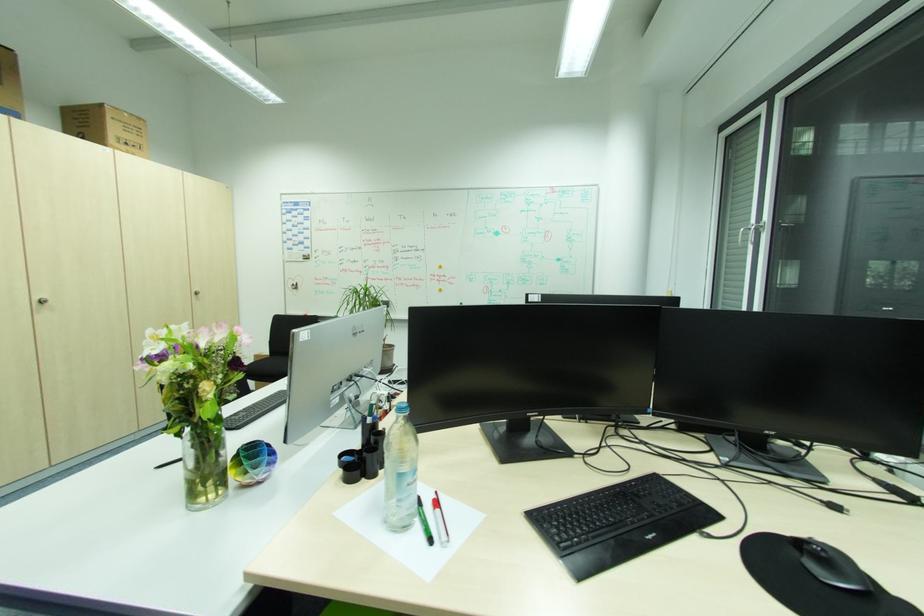
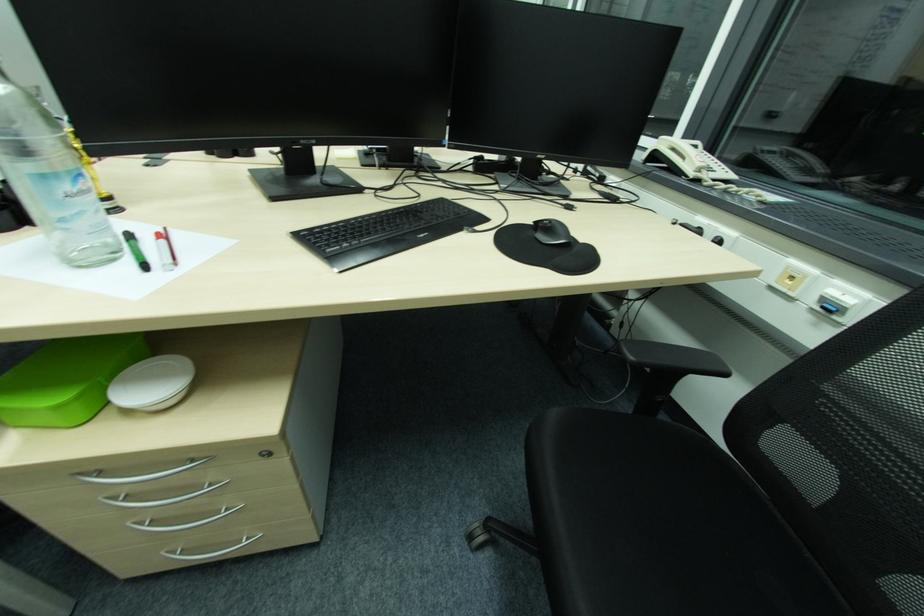
Find the pixel in the second image that matches pixel 436 541 in the first image.

(149, 267)